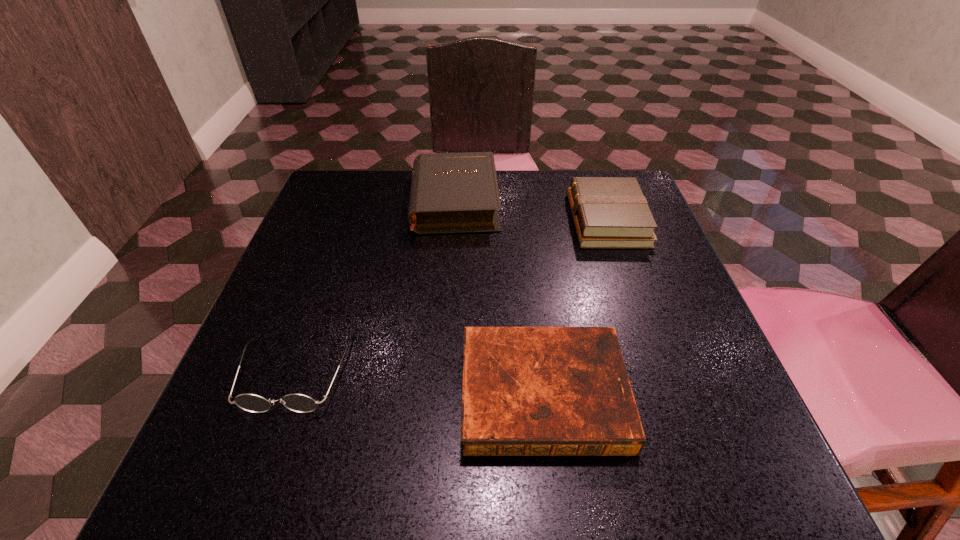
This screenshot has width=960, height=540. Find the location of `spectacles`. spectacles is located at coordinates (300, 403).

You are a GUI agent. You are given a task and a screenshot of the screen. Output one action in this format:
    pyautogui.click(x=<x>, y=<y>)
    Task: Click on the shortest object
    Image resolution: width=960 pixels, height=540 pixels.
    Given the screenshot: What is the action you would take?
    [527, 391]

The height and width of the screenshot is (540, 960). What are the coordinates of `the nearest Bible` in the screenshot? It's located at (x=527, y=391).

The image size is (960, 540). I want to click on vacant point located through the lenses of the leftmost object, so click(270, 447).

I want to click on object that is positioned at the near edge, so click(527, 391).

Find the location of a particular element. Image resolution: width=960 pixels, height=540 pixels. object situated at the left edge is located at coordinates click(300, 403).

Identify the location of object that is at the right edge. The height and width of the screenshot is (540, 960). (608, 212).

In order to click on object present at the far right corner in this screenshot , I will do `click(608, 212)`.

The image size is (960, 540). In the image, there is a desktop. Identify the location of vacant space at the far edge. (555, 169).

The image size is (960, 540). In the image, there is a desktop. Identify the location of vacant region at the left edge. (349, 246).